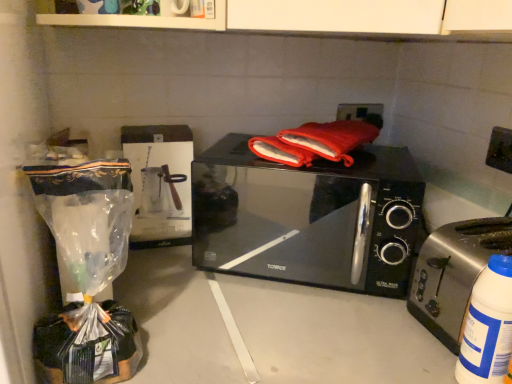
You are a GUI agent. You are given a task and a screenshot of the screen. Output one action in this format:
    pyautogui.click(x=<x>, y=<y>)
    Task: Click on the free spot to the left of satin silver toaster at right
    
    Given the screenshot: What is the action you would take?
    pyautogui.click(x=357, y=318)